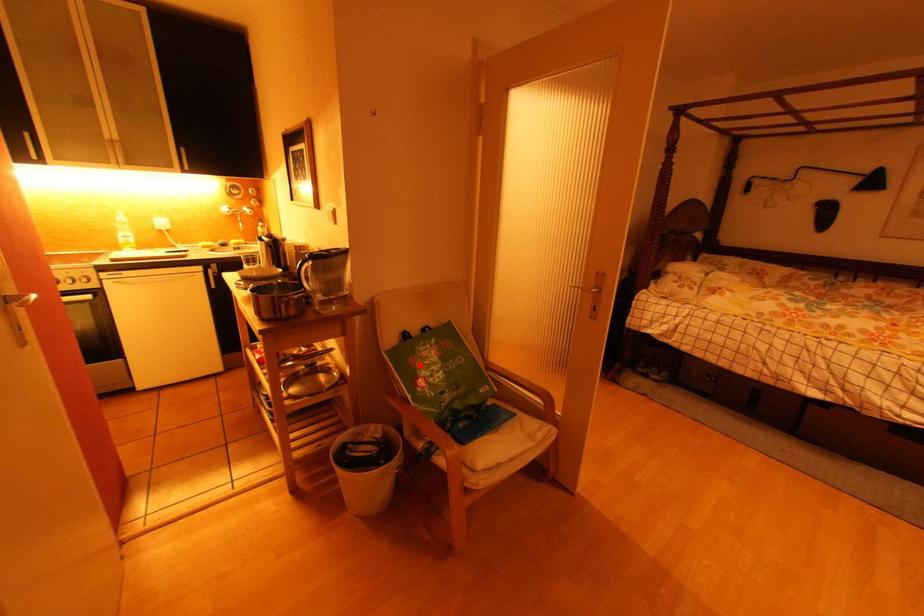
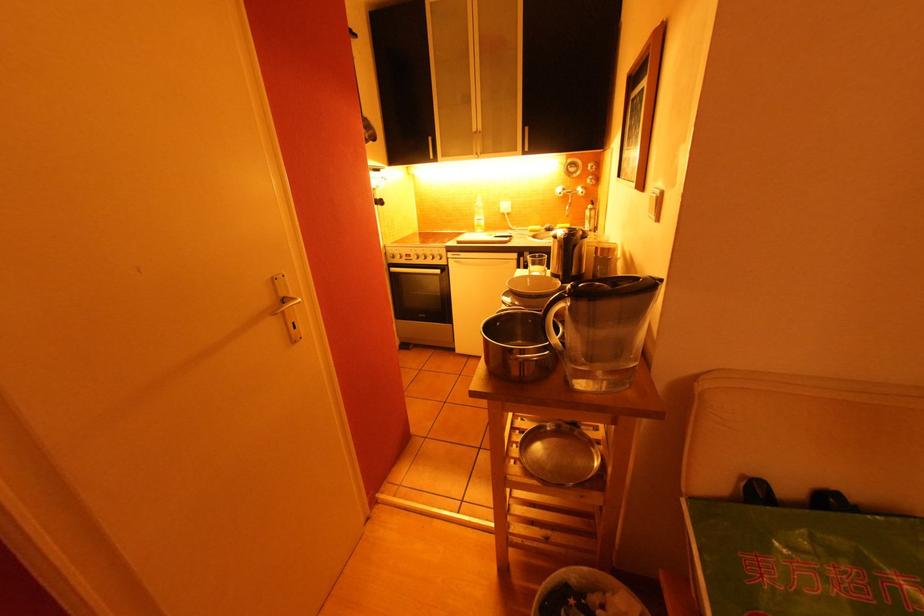
In the second image, find the point that corresponds to the highlighted location in the first image.

(766, 578)